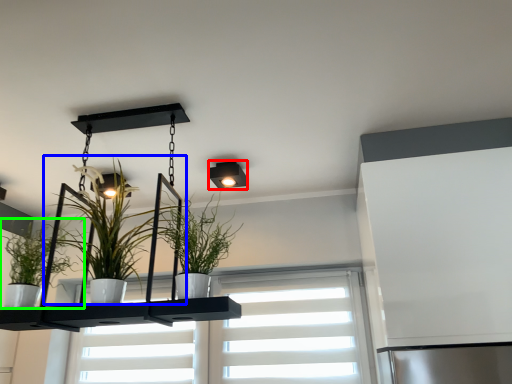
Question: Which is farther away from light fixture (highlighted by a red box)? houseplant (highlighted by a blue box) or houseplant (highlighted by a green box)?

Choices:
 (A) houseplant
 (B) houseplant

Answer: (B)